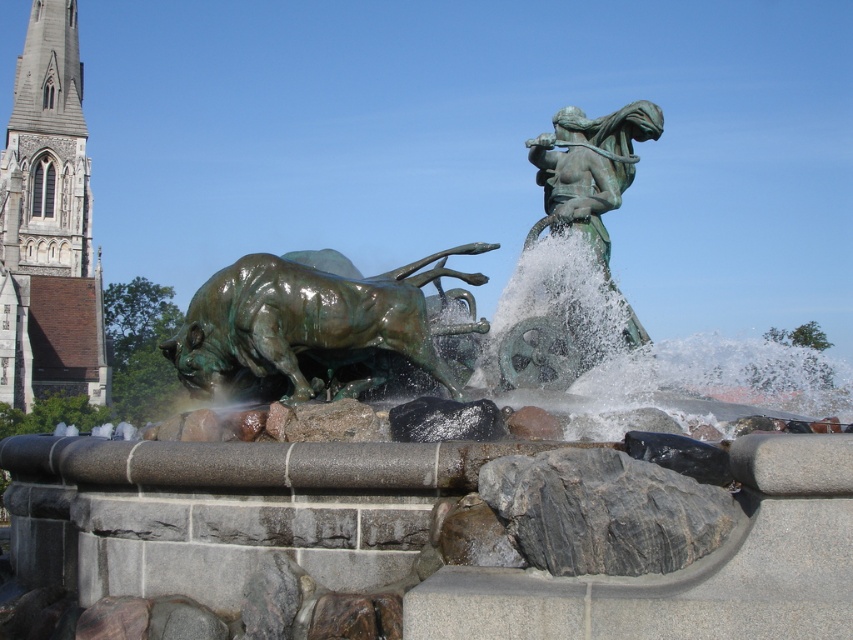
Which is more to the left, stone tower at left or bronze statue at upper right?

stone tower at left is more to the left.

Can you confirm if stone tower at left is smaller than bronze statue at upper right?

Actually, stone tower at left might be larger than bronze statue at upper right.

Is point (22, 198) positioned behind point (582, 228)?

Yes.

Locate an element on the screen. This screenshot has width=853, height=640. stone tower at left is located at coordinates (48, 225).

Who is positioned more to the right, stone tower at left or bronze/greenish patina bull at center?

Positioned to the right is bronze/greenish patina bull at center.

Is stone tower at left smaller than bronze/greenish patina bull at center?

Actually, stone tower at left might be larger than bronze/greenish patina bull at center.

Image resolution: width=853 pixels, height=640 pixels. I want to click on stone tower at left, so click(48, 225).

You are a GUI agent. You are given a task and a screenshot of the screen. Output one action in this format:
    pyautogui.click(x=<x>, y=<y>)
    Task: Click on the stone tower at left
    The height and width of the screenshot is (640, 853).
    Given the screenshot: What is the action you would take?
    pyautogui.click(x=48, y=225)

Where is `bronze/greenish patina bull at center`? bronze/greenish patina bull at center is located at coordinates (311, 326).

Does bronze/greenish patina bull at center come behind bronze statue at upper right?

No, bronze/greenish patina bull at center is closer to the viewer.

Who is more distant from viewer, (395, 300) or (590, 166)?

Positioned behind is point (590, 166).

At what (x,y) coordinates should I click in order to perform the action: click on bronze/greenish patina bull at center. Please return your answer as a coordinate pair (x, y). Looking at the image, I should click on (311, 326).